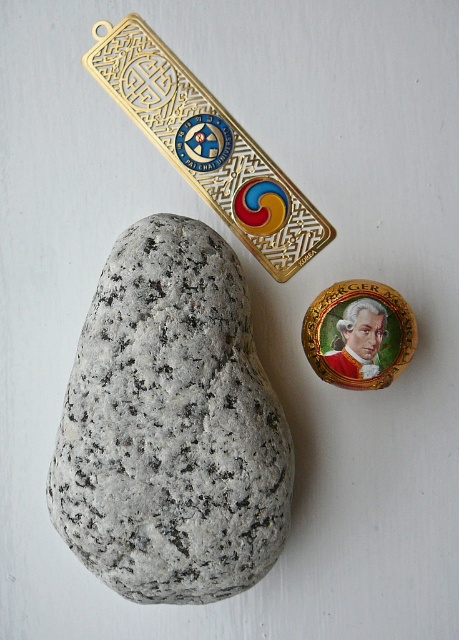
Question: From the image, what is the correct spatial relationship of gold metallic bookmark at upper center in relation to gold metallic badge at upper center?

Choices:
 (A) above
 (B) below

Answer: (A)

Question: Considering the real-world distances, which object is closest to the gold metallic badge at upper center?

Choices:
 (A) granite rock at center
 (B) gold metallic bookmark at upper center

Answer: (A)

Question: Is granite rock at center thinner than gold metallic bookmark at upper center?

Choices:
 (A) yes
 (B) no

Answer: (A)

Question: Which is farther from the granite rock at center?

Choices:
 (A) gold metallic badge at upper center
 (B) gold metallic bookmark at upper center

Answer: (B)

Question: Is granite rock at center further to the viewer compared to gold metallic badge at upper center?

Choices:
 (A) yes
 (B) no

Answer: (B)

Question: Which of the following is the closest to the observer?

Choices:
 (A) gold metallic badge at upper center
 (B) granite rock at center
 (C) gold metallic bookmark at upper center

Answer: (B)